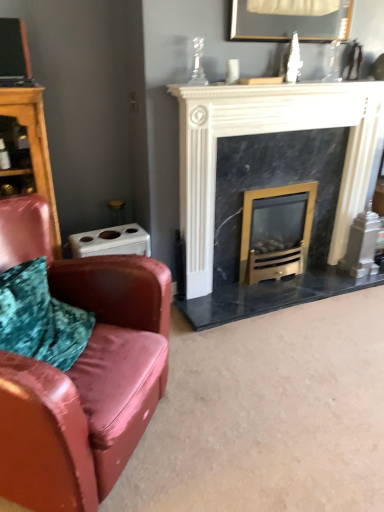
Question: Is gold metallic wood burning stove at center completely or partially inside black marble fireplace at center?

Choices:
 (A) no
 (B) yes

Answer: (B)

Question: From the image's perspective, is black marble fireplace at center above gold metallic wood burning stove at center?

Choices:
 (A) no
 (B) yes

Answer: (B)

Question: Is black marble fireplace at center not inside gold metallic wood burning stove at center?

Choices:
 (A) no
 (B) yes

Answer: (B)

Question: Is black marble fireplace at center oriented away from gold metallic wood burning stove at center?

Choices:
 (A) yes
 (B) no

Answer: (A)

Question: Is black marble fireplace at center thinner than gold metallic wood burning stove at center?

Choices:
 (A) yes
 (B) no

Answer: (A)

Question: Does point (244, 86) appear closer or farther from the camera than point (89, 402)?

Choices:
 (A) farther
 (B) closer

Answer: (A)

Question: Considering the relative positions of black marble fireplace at center and leather couch at left in the image provided, is black marble fireplace at center to the left or to the right of leather couch at left?

Choices:
 (A) left
 (B) right

Answer: (B)

Question: Is black marble fireplace at center bigger or smaller than leather couch at left?

Choices:
 (A) big
 (B) small

Answer: (B)

Question: Considering the positions of black marble fireplace at center and leather couch at left in the image, is black marble fireplace at center taller or shorter than leather couch at left?

Choices:
 (A) short
 (B) tall

Answer: (B)

Question: From a real-world perspective, is wooden dresser at left physically located above or below gold metallic wood burning stove at center?

Choices:
 (A) below
 (B) above

Answer: (B)

Question: Considering the positions of wooden dresser at left and gold metallic wood burning stove at center in the image, is wooden dresser at left wider or thinner than gold metallic wood burning stove at center?

Choices:
 (A) wide
 (B) thin

Answer: (A)

Question: Relative to gold metallic wood burning stove at center, is wooden dresser at left in front or behind?

Choices:
 (A) behind
 (B) front

Answer: (B)

Question: Considering the relative positions of wooden dresser at left and gold metallic wood burning stove at center in the image provided, is wooden dresser at left to the left or to the right of gold metallic wood burning stove at center?

Choices:
 (A) right
 (B) left

Answer: (B)

Question: Which is correct: black marble fireplace at center is inside gold metallic wood burning stove at center, or outside of it?

Choices:
 (A) inside
 (B) outside

Answer: (B)

Question: From a real-world perspective, relative to gold metallic wood burning stove at center, is black marble fireplace at center vertically above or below?

Choices:
 (A) below
 (B) above

Answer: (B)